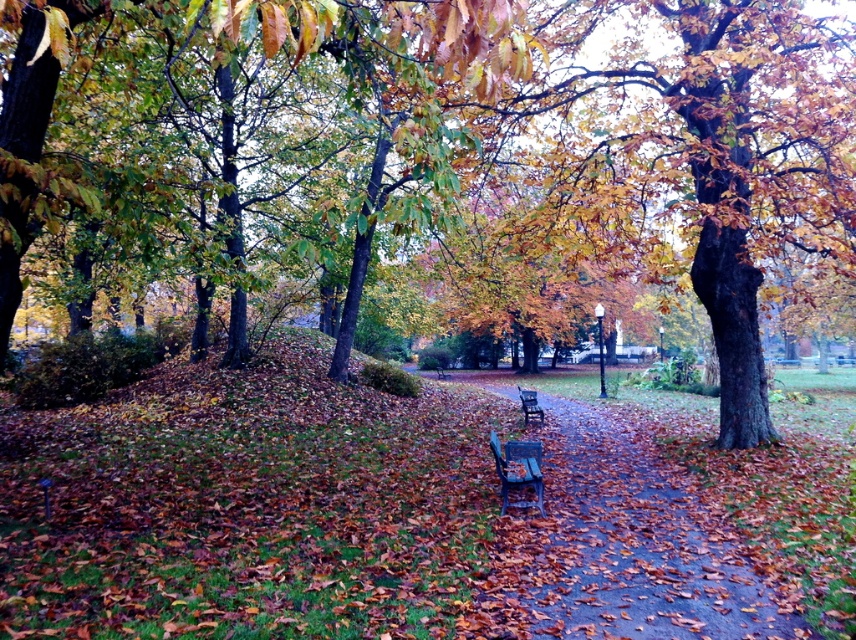
Is smooth concrete path at center to the right of wooden bench at center from the viewer's perspective?

Correct, you'll find smooth concrete path at center to the right of wooden bench at center.

Is smooth concrete path at center below wooden bench at center?

Indeed, smooth concrete path at center is positioned under wooden bench at center.

This screenshot has height=640, width=856. What do you see at coordinates (617, 548) in the screenshot?
I see `smooth concrete path at center` at bounding box center [617, 548].

The height and width of the screenshot is (640, 856). Identify the location of smooth concrete path at center. (617, 548).

Is point (550, 502) positioned behind point (533, 396)?

No.

Is smooth concrete path at center bigger than dark brown wooden bench at center?

Yes.

Between point (655, 586) and point (526, 401), which one is positioned behind?

The point (526, 401) is more distant.

Locate an element on the screen. The width and height of the screenshot is (856, 640). smooth concrete path at center is located at coordinates (617, 548).

Between wooden bench at center and dark brown wooden bench at center, which one has less height?

dark brown wooden bench at center is shorter.

Is wooden bench at center to the left of dark brown wooden bench at center from the viewer's perspective?

Indeed, wooden bench at center is positioned on the left side of dark brown wooden bench at center.

This screenshot has width=856, height=640. In order to click on wooden bench at center in this screenshot , I will do `click(522, 465)`.

The width and height of the screenshot is (856, 640). In order to click on wooden bench at center in this screenshot , I will do `click(522, 465)`.